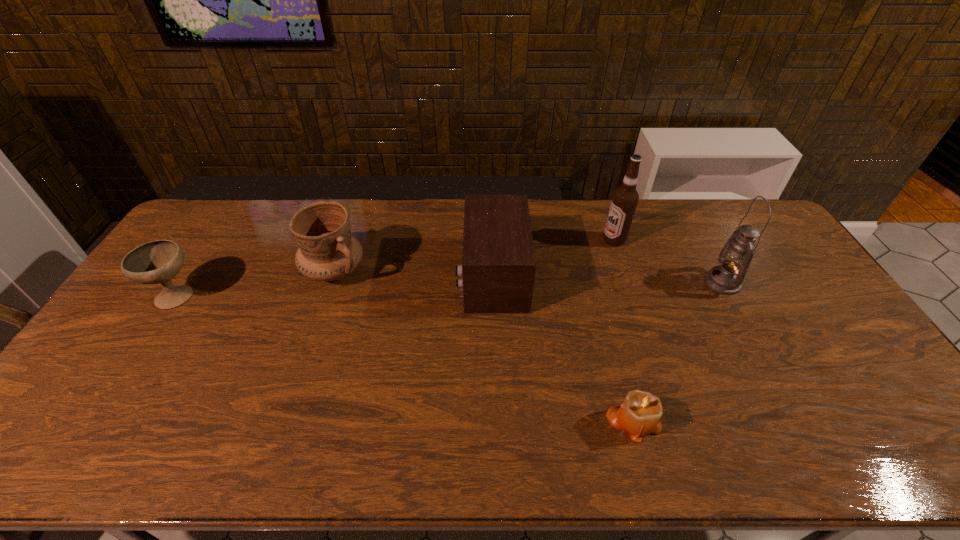
The width and height of the screenshot is (960, 540). What are the coordinates of `unoccupied area between the alcohol and the radio receiver` in the screenshot? It's located at (553, 258).

At what (x,y) coordinates should I click in order to perform the action: click on vacant area that lies between the chalice and the oil lamp. Please return your answer as a coordinate pair (x, y). Looking at the image, I should click on (450, 289).

At what (x,y) coordinates should I click in order to perform the action: click on vacant region between the chalice and the radio receiver. Please return your answer as a coordinate pair (x, y). This screenshot has height=540, width=960. Looking at the image, I should click on (335, 285).

Where is `vacant region between the alcohol and the third object from left to right`? Image resolution: width=960 pixels, height=540 pixels. vacant region between the alcohol and the third object from left to right is located at coordinates pyautogui.click(x=553, y=258).

Identify which object is located as the fifth nearest to the candle. Please provide its 2D coordinates. Your answer should be formatted as a tuple, i.e. [(x, y)], where the tuple contains the x and y coordinates of a point satisfying the conditions above.

[(155, 262)]

This screenshot has height=540, width=960. In order to click on the second closest object to the shortest object in this screenshot , I will do `click(735, 257)`.

Where is `free spot that satisfies the following two spatial constraints: 1. on the front-facing side of the radio receiver; 2. on the left side of the oil lamp`? free spot that satisfies the following two spatial constraints: 1. on the front-facing side of the radio receiver; 2. on the left side of the oil lamp is located at coordinates (492, 282).

The image size is (960, 540). Find the location of `free space that satisfies the following two spatial constraints: 1. on the back side of the rightmost object; 2. on the left side of the candle`. free space that satisfies the following two spatial constraints: 1. on the back side of the rightmost object; 2. on the left side of the candle is located at coordinates (597, 282).

Identify the location of vacant space that satisfies the following two spatial constraints: 1. on the back side of the rightmost object; 2. on the right side of the chalice. This screenshot has height=540, width=960. click(x=186, y=282).

The width and height of the screenshot is (960, 540). Identify the location of vacant space that satisfies the following two spatial constraints: 1. on the front side of the fifth object from right to left; 2. on the left side of the nearest object. (284, 420).